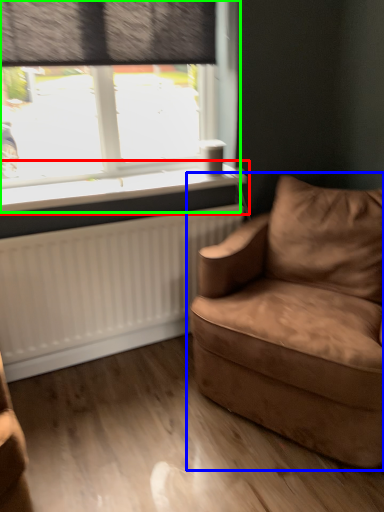
Question: Which object is the closest to the window sill (highlighted by a red box)? Choose among these: studio couch (highlighted by a blue box) or window (highlighted by a green box).

Choices:
 (A) studio couch
 (B) window

Answer: (B)